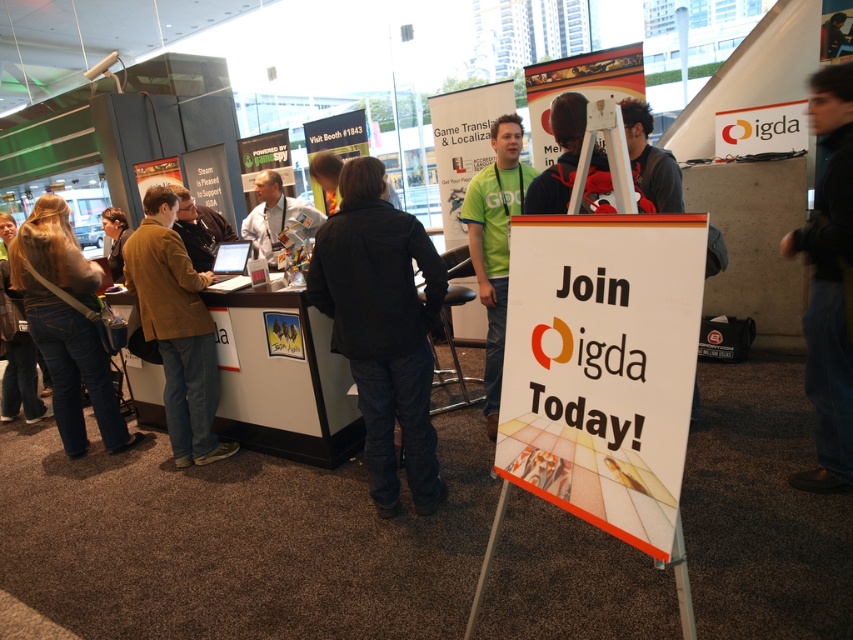
Question: Which of the following is the farthest from the observer?

Choices:
 (A) (380, 355)
 (B) (123, 236)

Answer: (B)

Question: Can you confirm if green matte t-shirt at center is smaller than brown leather jacket at left?

Choices:
 (A) yes
 (B) no

Answer: (B)

Question: Is brown suede jacket at left above dark brown leather jacket at left?

Choices:
 (A) yes
 (B) no

Answer: (B)

Question: Which point appears closest to the camera in this image?

Choices:
 (A) (74, 330)
 (B) (183, 364)

Answer: (B)

Question: Considering the real-world distances, which object is farthest from the denim jacket at left?

Choices:
 (A) dark brown leather jacket at left
 (B) brown leather jacket at left
 (C) black leather jacket at center

Answer: (C)

Question: Does white paper sign at center have a smaller size compared to denim jacket at left?

Choices:
 (A) yes
 (B) no

Answer: (A)